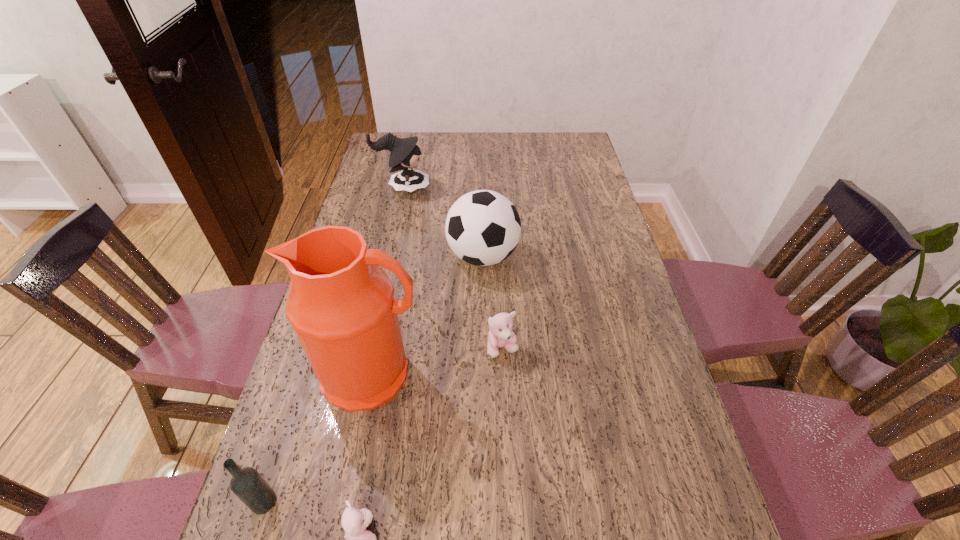
Identify the location of the fifth tallest object. (500, 335).

In order to click on the taller teddy bear in this screenshot , I will do `click(500, 335)`.

Where is `doll`? This screenshot has height=540, width=960. doll is located at coordinates (404, 155).

Locate an element on the screen. This screenshot has width=960, height=540. the second farthest object is located at coordinates (483, 227).

The height and width of the screenshot is (540, 960). I want to click on the tallest object, so click(341, 304).

You are a GUI agent. You are given a task and a screenshot of the screen. Output one action in this format:
    pyautogui.click(x=<x>, y=<y>)
    Task: Click on the leftmost object
    This screenshot has width=960, height=540.
    Given the screenshot: What is the action you would take?
    pyautogui.click(x=247, y=484)

You are a GUI agent. You are given a task and a screenshot of the screen. Output one action in this format:
    pyautogui.click(x=<x>, y=<y>)
    Task: Click on the third shortest object
    
    Given the screenshot: What is the action you would take?
    pyautogui.click(x=247, y=484)

Where is `free space located at the face of the right teddy bear`? This screenshot has width=960, height=540. free space located at the face of the right teddy bear is located at coordinates (507, 442).

This screenshot has width=960, height=540. What are the coordinates of `free space located 0.320m at the face of the farthest object` in the screenshot? It's located at (516, 188).

Where is `free spot located 0.110m on the back of the fifth nearest object`? free spot located 0.110m on the back of the fifth nearest object is located at coordinates (483, 213).